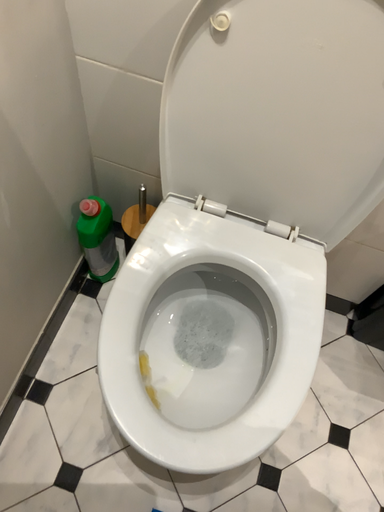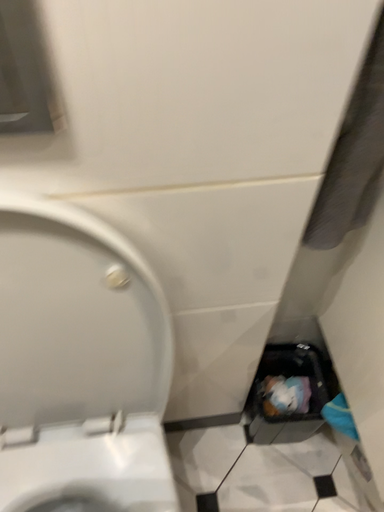
Question: How did the camera likely rotate when shooting the video?

Choices:
 (A) rotated downward
 (B) rotated upward

Answer: (B)